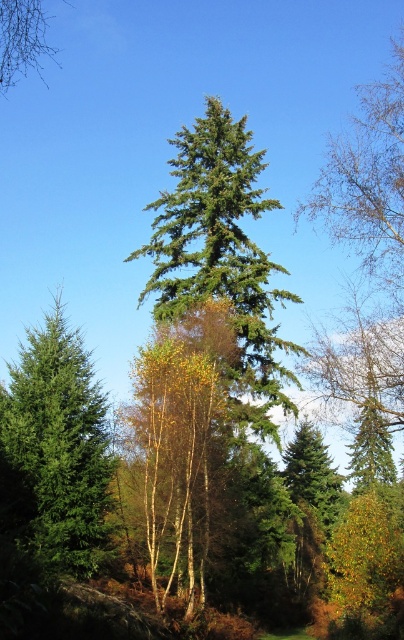
Question: Among these objects, which one is nearest to the camera?

Choices:
 (A) green matte tree at center
 (B) bare branches at upper left
 (C) green matte evergreen tree at left

Answer: (B)

Question: Can you confirm if green matte tree at center is wider than bare branches at upper left?

Choices:
 (A) yes
 (B) no

Answer: (B)

Question: Which object appears closest to the camera in this image?

Choices:
 (A) green matte evergreen tree at left
 (B) bare branches at upper left
 (C) green matte tree at center

Answer: (B)

Question: Does green matte tree at center come in front of bare branches at upper left?

Choices:
 (A) yes
 (B) no

Answer: (B)

Question: Can you confirm if green matte tree at center is positioned below bare branches at upper left?

Choices:
 (A) yes
 (B) no

Answer: (A)

Question: Which of these objects is positioned closest to the bare branches at upper left?

Choices:
 (A) green matte tree at center
 (B) green matte evergreen tree at left

Answer: (A)